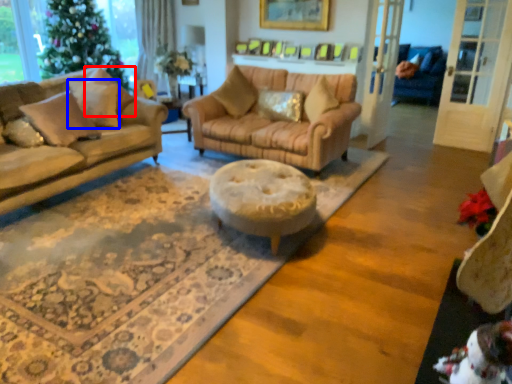
Question: Which object is further to the camera taking this photo, pillow (highlighted by a red box) or pillow (highlighted by a blue box)?

Choices:
 (A) pillow
 (B) pillow

Answer: (B)